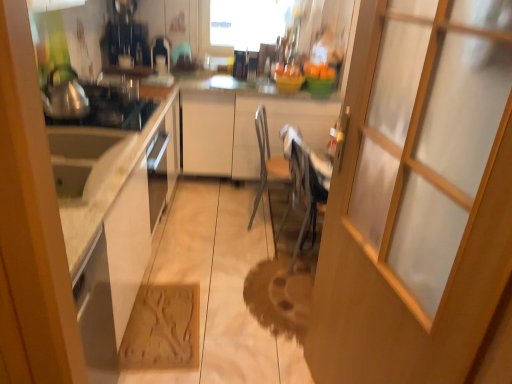
Question: Considering the positions of transparent glass door at center and brushed metal tea pot at left in the image, is transparent glass door at center bigger or smaller than brushed metal tea pot at left?

Choices:
 (A) small
 (B) big

Answer: (B)

Question: Would you say transparent glass door at center is inside or outside brushed metal tea pot at left?

Choices:
 (A) outside
 (B) inside

Answer: (A)

Question: Estimate the real-world distances between objects in this image. Which object is closer to the metallic silver chair at center, the 1th chair in the back-to-front sequence?

Choices:
 (A) white matte cabinet at center
 (B) brushed metal tea pot at left
 (C) shiny metallic gas stove at left
 (D) transparent glass door at center
 (E) metallic gray chair at center, arranged as the 2th chair when viewed from the back

Answer: (A)

Question: Which object is positioned closest to the metallic silver chair at center, the 1th chair in the back-to-front sequence?

Choices:
 (A) brushed metal tea pot at left
 (B) transparent glass window at upper center
 (C) metallic gray chair at center, the first chair positioned from the front
 (D) white matte cabinet at center
 (E) brown textured mat at lower center

Answer: (D)